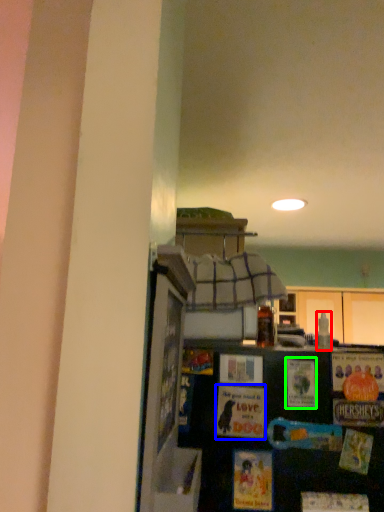
Question: Estimate the real-world distances between objects in this image. Which object is farther from bottle (highlighted by a red box), postcard (highlighted by a blue box) or postcard (highlighted by a green box)?

Choices:
 (A) postcard
 (B) postcard

Answer: (B)